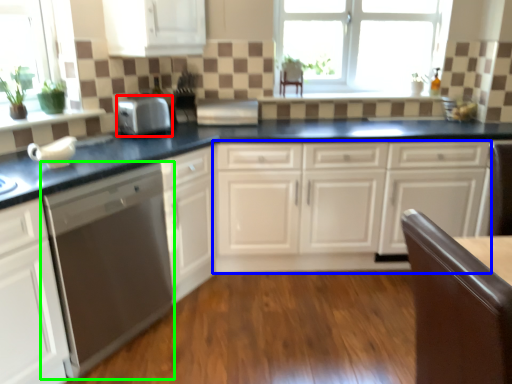
Question: Estimate the real-world distances between objects in this image. Which object is closer to kitchen appliance (highlighted by a red box), cabinetry (highlighted by a blue box) or home appliance (highlighted by a green box)?

Choices:
 (A) cabinetry
 (B) home appliance

Answer: (B)